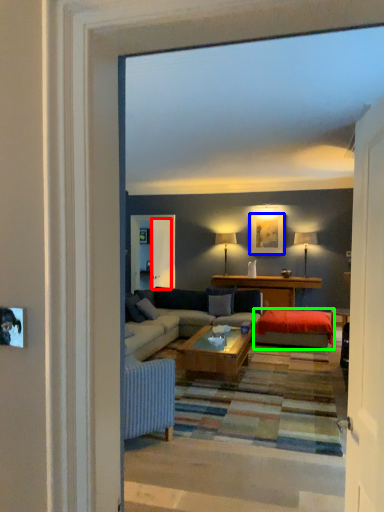
Question: Considering the real-world distances, which object is closest to screen door (highlighted by a red box)? picture frame (highlighted by a blue box) or wide (highlighted by a green box).

Choices:
 (A) picture frame
 (B) wide

Answer: (A)